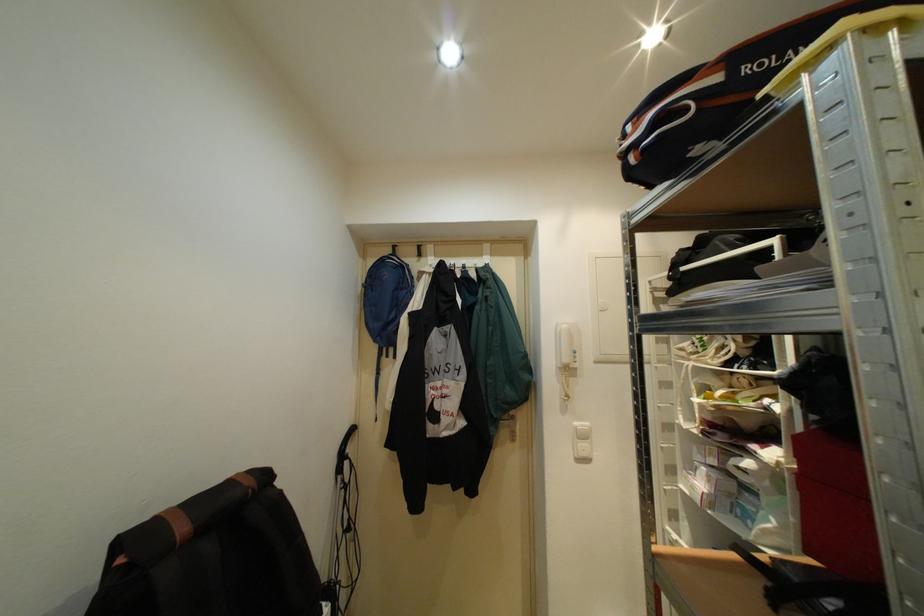
Where is `vacuum cleaner handle`? This screenshot has height=616, width=924. vacuum cleaner handle is located at coordinates (345, 469).